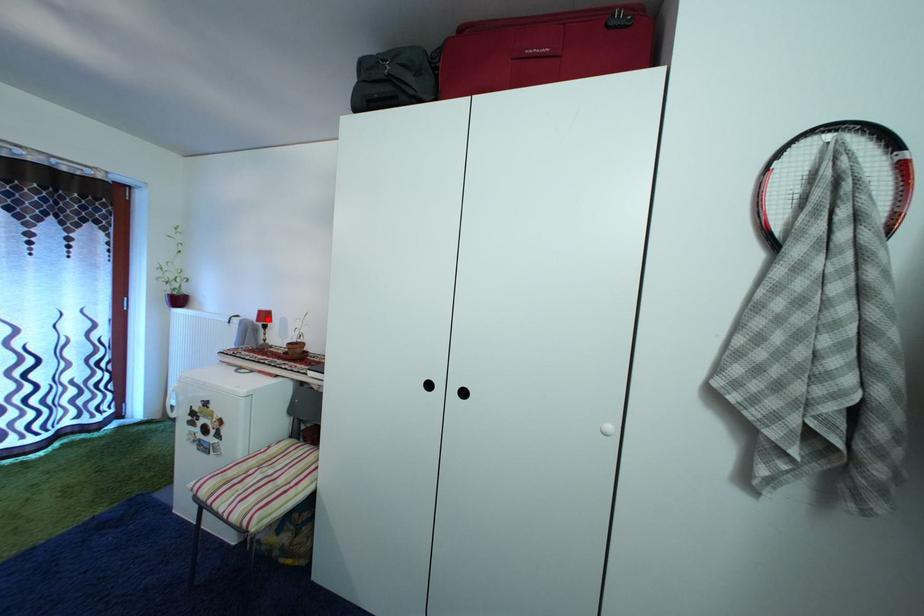
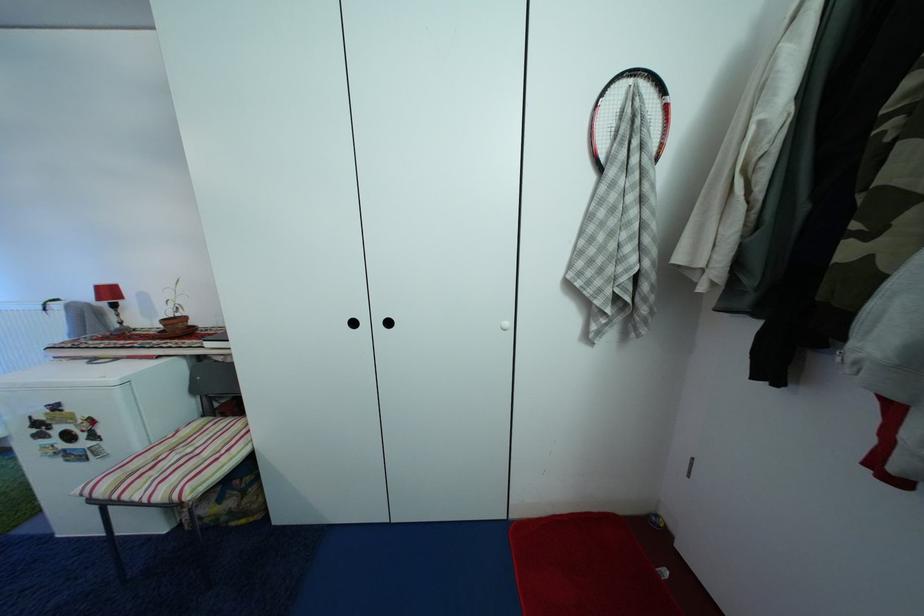
Locate, in the second image, the point that corresponds to the highlighted location in the first image.

(106, 294)